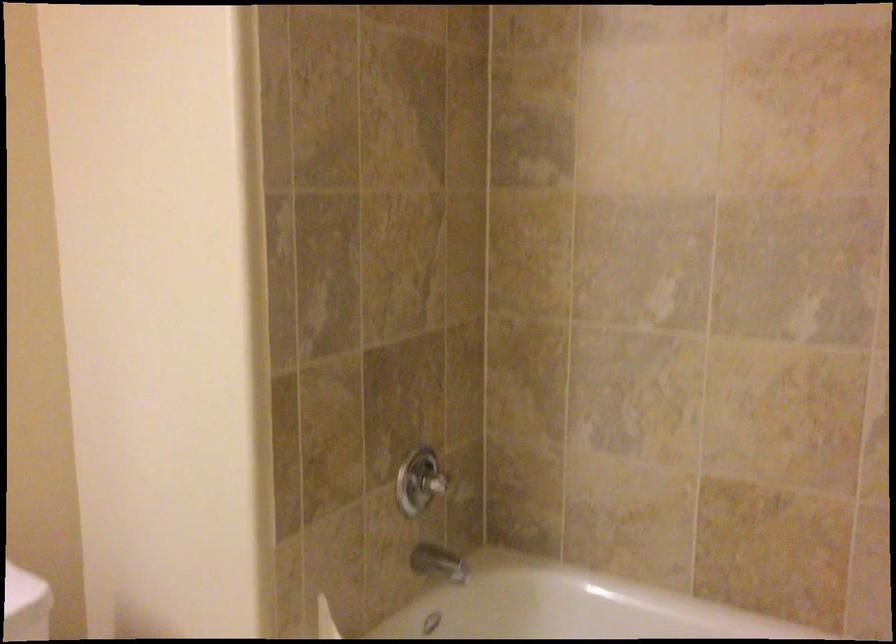
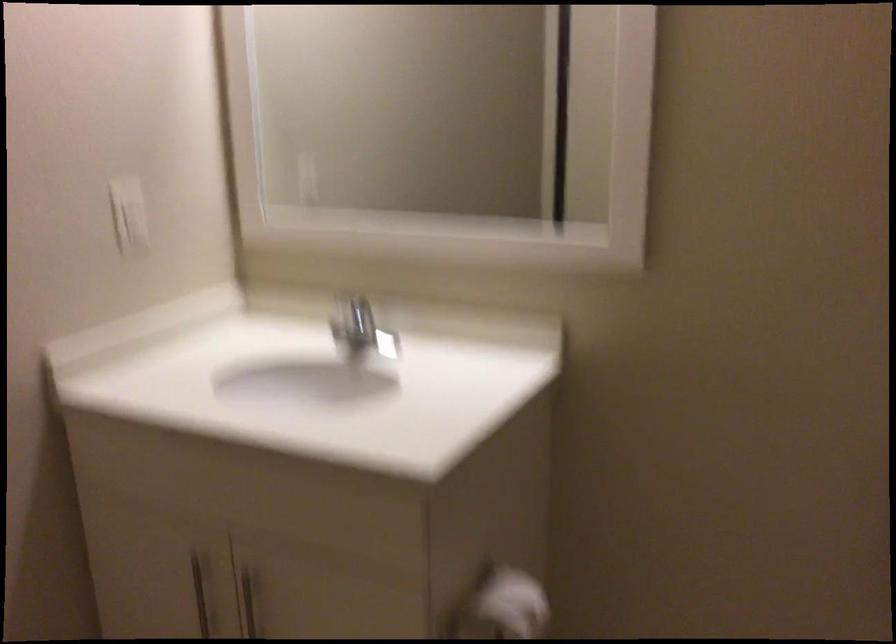
The first image is from the beginning of the video and the second image is from the end. How did the camera likely rotate when shooting the video?

The camera rotated toward left-down.